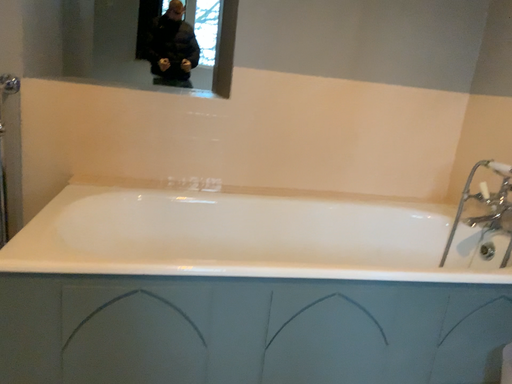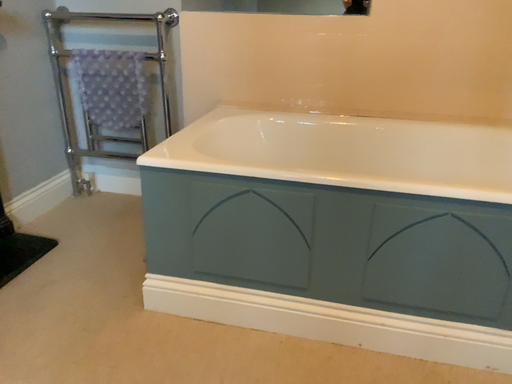
Question: Which way did the camera rotate in the video?

Choices:
 (A) rotated downward
 (B) rotated upward

Answer: (A)